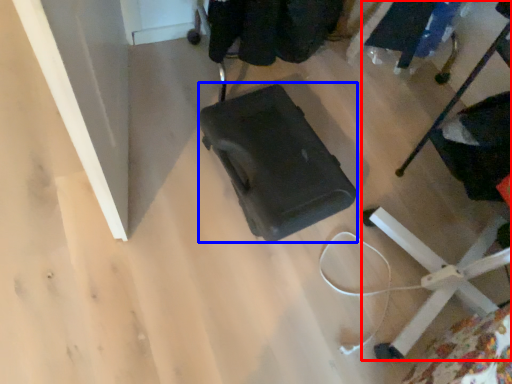
Question: Among these objects, which one is farthest to the camera, furniture (highlighted by a red box) or baby carriage (highlighted by a blue box)?

Choices:
 (A) furniture
 (B) baby carriage

Answer: (B)